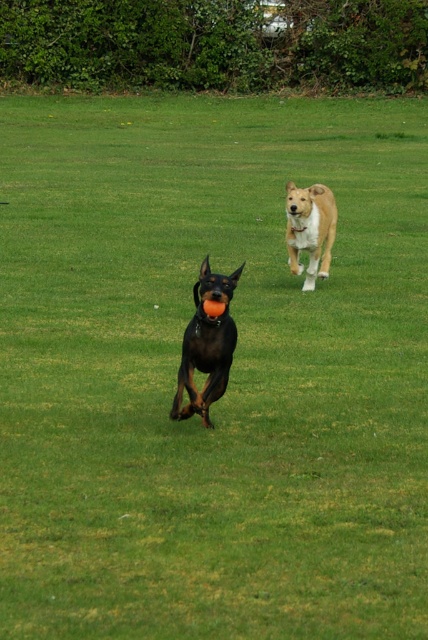
Who is positioned more to the right, shiny black dog at center or light brown fur at center?

light brown fur at center is more to the right.

Can you confirm if shiny black dog at center is positioned to the left of light brown fur at center?

Correct, you'll find shiny black dog at center to the left of light brown fur at center.

The height and width of the screenshot is (640, 428). I want to click on shiny black dog at center, so click(x=207, y=346).

Where is `shiny black dog at center`? The image size is (428, 640). shiny black dog at center is located at coordinates (207, 346).